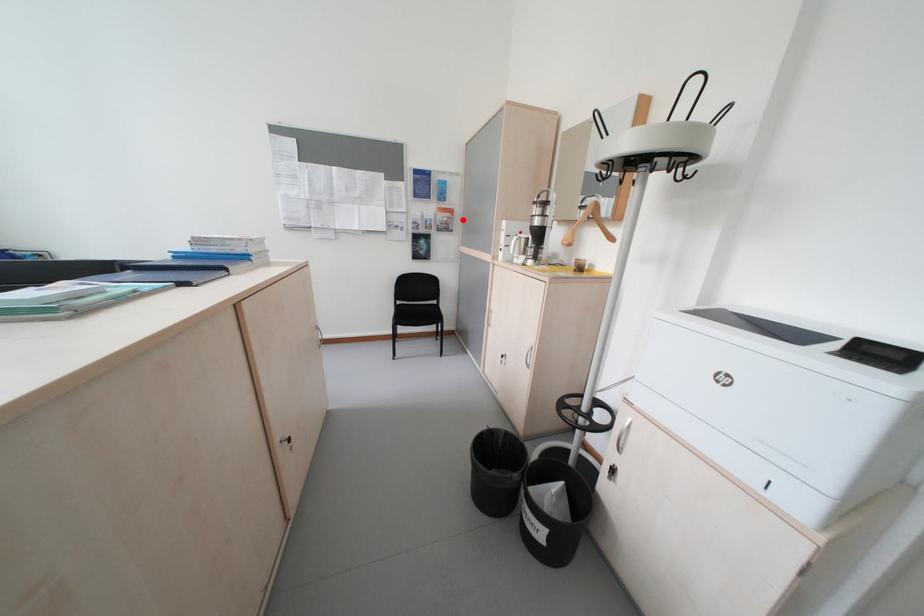
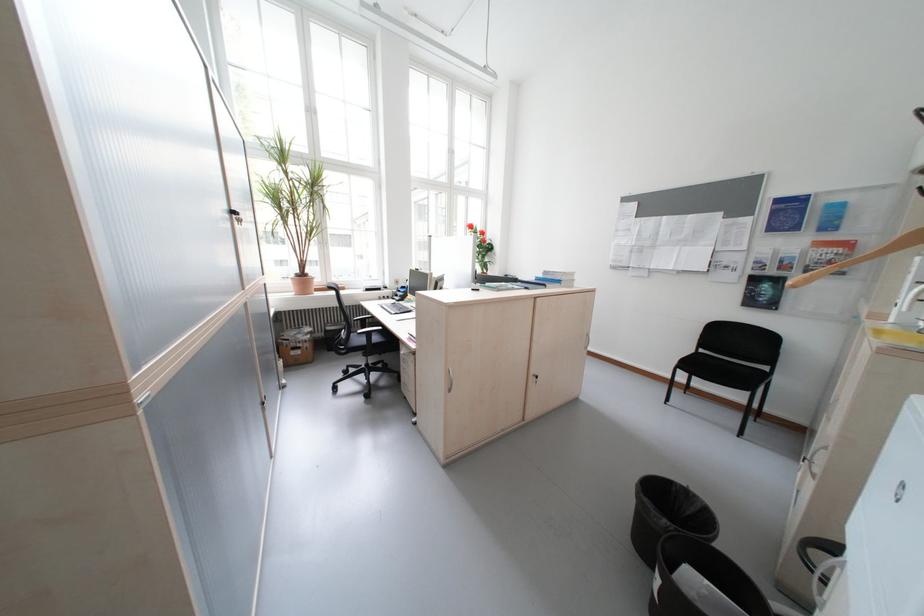
The point at the highlighted location is marked in the first image. Where is the corresponding point in the second image?

(859, 257)